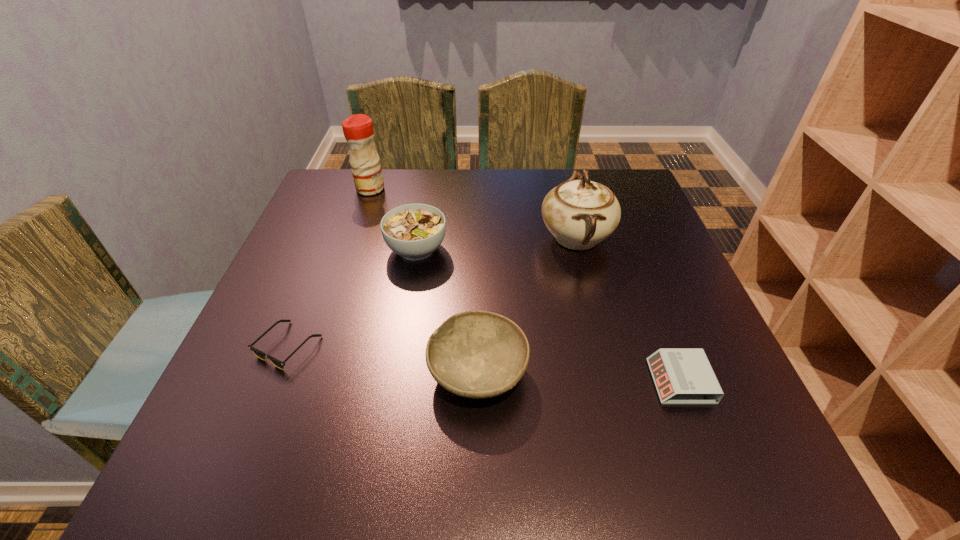
What are the coordinates of `vacant space at the far edge` in the screenshot? It's located at (472, 172).

This screenshot has height=540, width=960. Find the location of `vacant space at the near edge`. vacant space at the near edge is located at coordinates (423, 474).

In the image, there is a desktop. At what (x,y) coordinates should I click in order to perform the action: click on vacant region at the left edge. Please return your answer as a coordinate pair (x, y). The height and width of the screenshot is (540, 960). Looking at the image, I should click on (311, 262).

In the image, there is a desktop. Where is `vacant space at the right edge`? Image resolution: width=960 pixels, height=540 pixels. vacant space at the right edge is located at coordinates (672, 334).

This screenshot has height=540, width=960. Find the location of `free point between the soup bowl and the second shortest object`. free point between the soup bowl and the second shortest object is located at coordinates (548, 315).

Locate an element on the screen. This screenshot has width=960, height=540. unoccupied position between the third shortest object and the chinaware is located at coordinates [x=527, y=305].

Locate an element on the screen. The height and width of the screenshot is (540, 960). free space between the third shortest object and the alarm clock is located at coordinates (579, 376).

Find the location of a particular element. This screenshot has width=960, height=540. free point between the alarm clock and the farthest object is located at coordinates (525, 285).

Find the location of a particular element. This screenshot has height=540, width=960. free spot between the third tallest object and the alarm clock is located at coordinates (548, 315).

Where is `free space between the shortest object and the chinaware`? The width and height of the screenshot is (960, 540). free space between the shortest object and the chinaware is located at coordinates (432, 292).